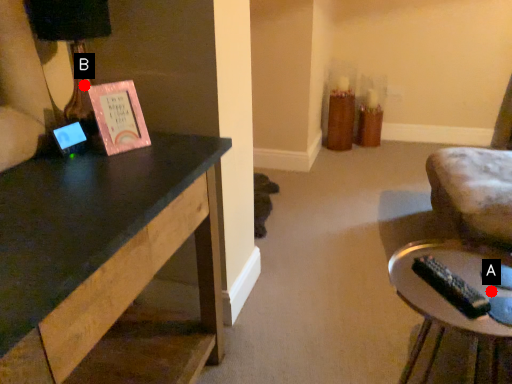
Question: Two points are circled on the image, labeled by A and B beside each circle. Which of the following is the farthest from the observer?

Choices:
 (A) A is further
 (B) B is further

Answer: (B)